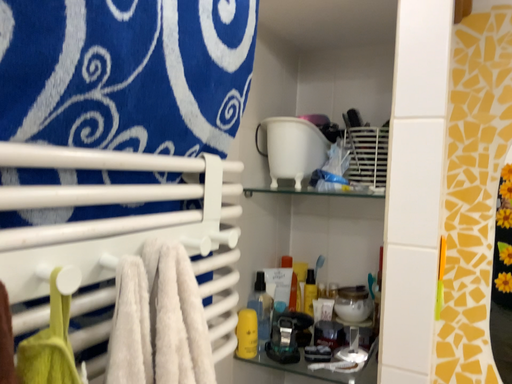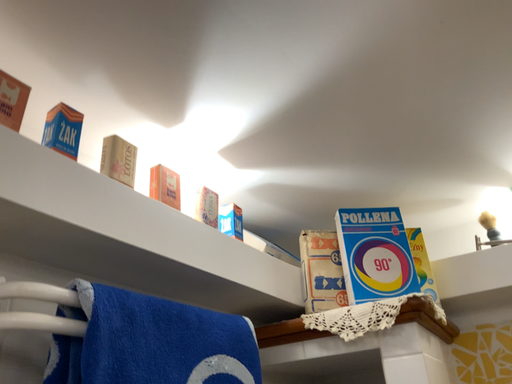
Question: Which way did the camera rotate in the video?

Choices:
 (A) rotated left
 (B) rotated right

Answer: (A)